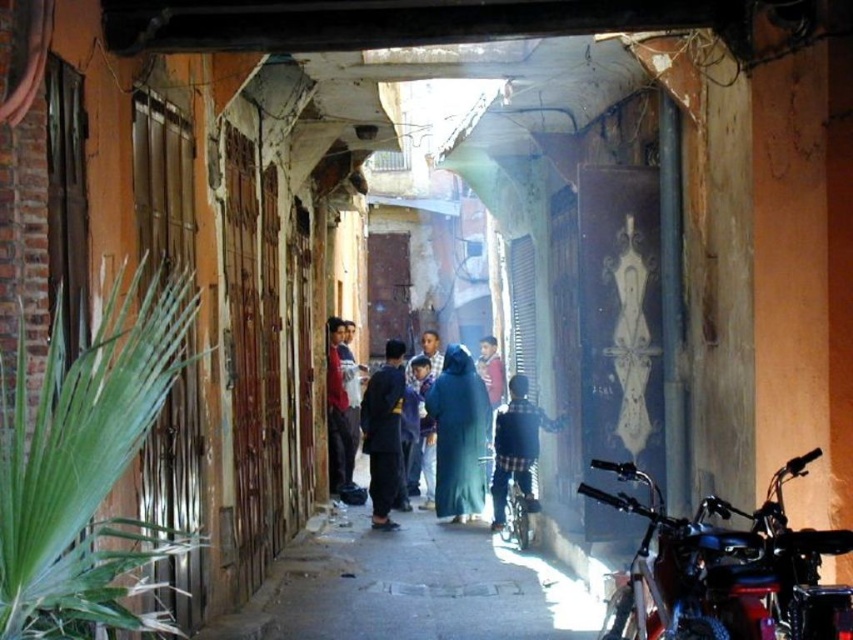
Question: Does dark brown fabric jacket at center have a larger size compared to plaid fabric shirt at center?

Choices:
 (A) yes
 (B) no

Answer: (B)

Question: Which is nearer to the blue fabric dress at center?

Choices:
 (A) shiny black motorcycle at lower right
 (B) dark blue fabric at center
 (C) dark brown fabric jacket at center
 (D) plaid fabric shirt at center

Answer: (C)

Question: Does plaid fabric shirt at center lie in front of dark blue fabric at center?

Choices:
 (A) no
 (B) yes

Answer: (B)

Question: Among these objects, which one is nearest to the camera?

Choices:
 (A) blue fabric dress at center
 (B) plaid fabric shirt at center
 (C) dark brown fabric jacket at center
 (D) dark blue fabric at center

Answer: (B)

Question: Which point is farther from the camera taking this photo?

Choices:
 (A) click(762, 557)
 (B) click(337, 458)
 (C) click(524, 500)
 (D) click(397, 369)

Answer: (B)

Question: Considering the relative positions of dark brown fabric jacket at center and plaid fabric shirt at center in the image provided, where is dark brown fabric jacket at center located with respect to plaid fabric shirt at center?

Choices:
 (A) below
 (B) above

Answer: (B)